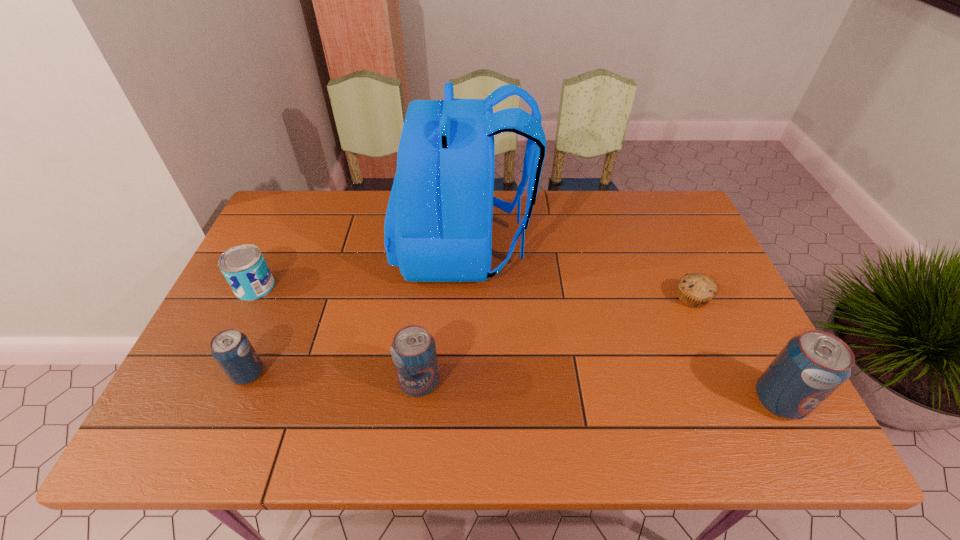
The width and height of the screenshot is (960, 540). I want to click on the shortest pop soda, so click(231, 349).

At what (x,y) coordinates should I click in order to perform the action: click on the second pop soda from left to right. Please return your answer as a coordinate pair (x, y). Looking at the image, I should click on (413, 350).

This screenshot has height=540, width=960. In order to click on the third tallest object in this screenshot , I will do `click(413, 350)`.

You are a GUI agent. You are given a task and a screenshot of the screen. Output one action in this format:
    pyautogui.click(x=<x>, y=<y>)
    Task: Click on the rightmost pop soda
    The width and height of the screenshot is (960, 540).
    Given the screenshot: What is the action you would take?
    pyautogui.click(x=813, y=365)

Locate an element on the screen. the second tallest object is located at coordinates (813, 365).

Where is `the tallest object`? The image size is (960, 540). the tallest object is located at coordinates (438, 227).

This screenshot has height=540, width=960. I want to click on the shortest object, so click(695, 290).

Where is `the fifth tallest object`? The image size is (960, 540). the fifth tallest object is located at coordinates (244, 267).

Locate an element on the screen. This screenshot has height=540, width=960. free space located on the right of the leftmost pop soda is located at coordinates (358, 374).

At what (x,y) coordinates should I click in order to perform the action: click on free space located 0.290m on the back of the second tallest pop soda. Please return your answer as a coordinate pair (x, y). Looking at the image, I should click on (431, 277).